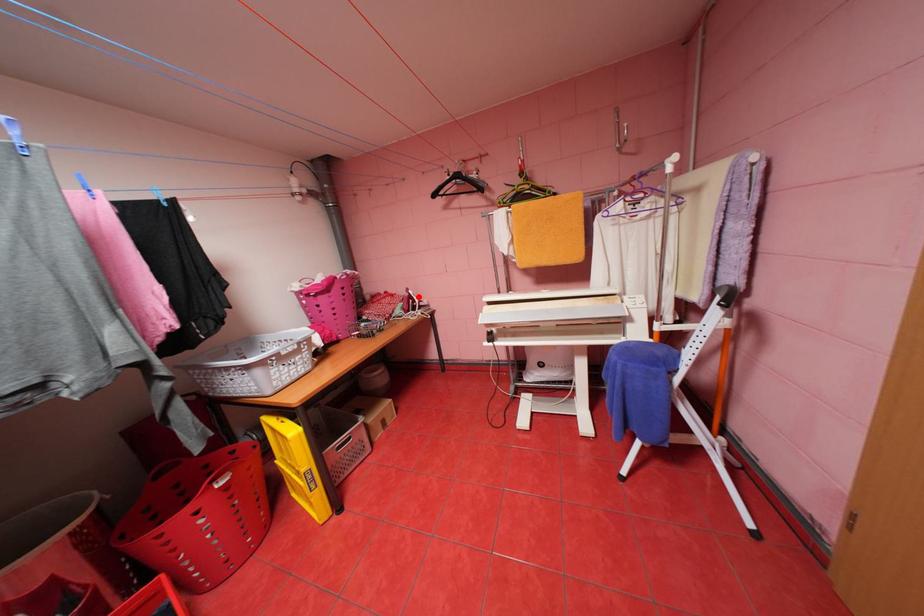
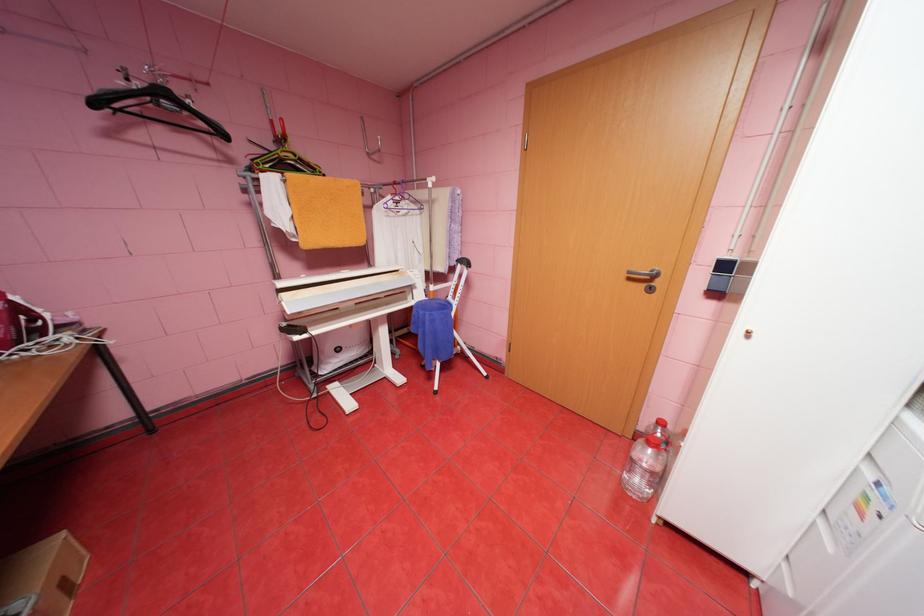
Question: I am providing you with two images of the same scene from different viewpoints. Image1 has a red point marked. In image2, the corresponding 3D location appears at what relative position? Reply with the corresponding letter.

Choices:
 (A) Closer
 (B) Farther

Answer: (B)